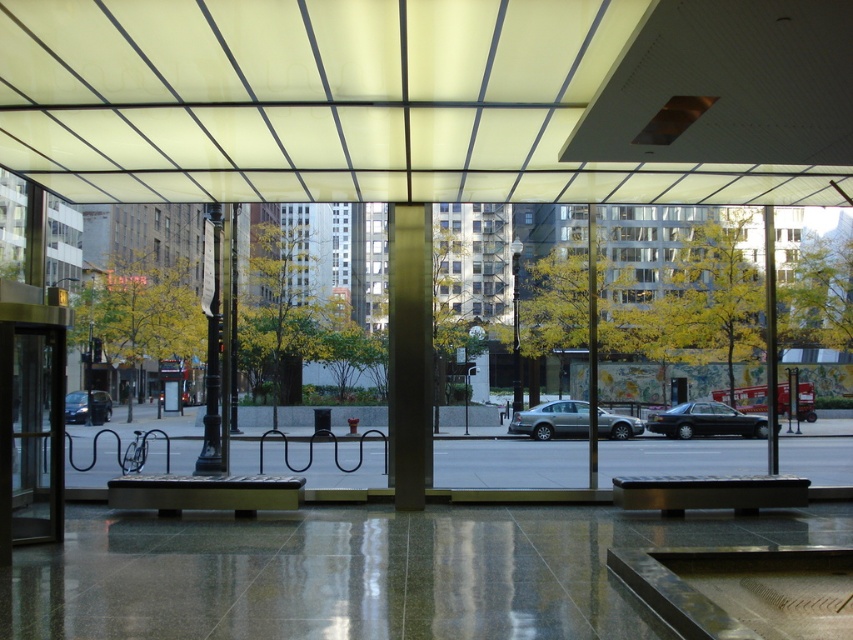
Question: Which object is the closest to the shiny black sedan at center?

Choices:
 (A) satin silver column at center
 (B) matte glass canopy at upper center
 (C) matte black car at left
 (D) satin silver sedan at center

Answer: (D)

Question: Which object appears closest to the camera in this image?

Choices:
 (A) shiny black sedan at center
 (B) satin silver sedan at center
 (C) matte glass canopy at upper center

Answer: (C)

Question: Does matte glass canopy at upper center come in front of satin silver column at center?

Choices:
 (A) yes
 (B) no

Answer: (A)

Question: Can you confirm if satin silver column at center is bigger than matte black car at left?

Choices:
 (A) yes
 (B) no

Answer: (B)

Question: Is satin silver column at center to the left of matte black car at left from the viewer's perspective?

Choices:
 (A) yes
 (B) no

Answer: (B)

Question: Among these points, which one is farthest from the camera?

Choices:
 (A) (96, 410)
 (B) (415, 376)
 (C) (635, 429)

Answer: (A)